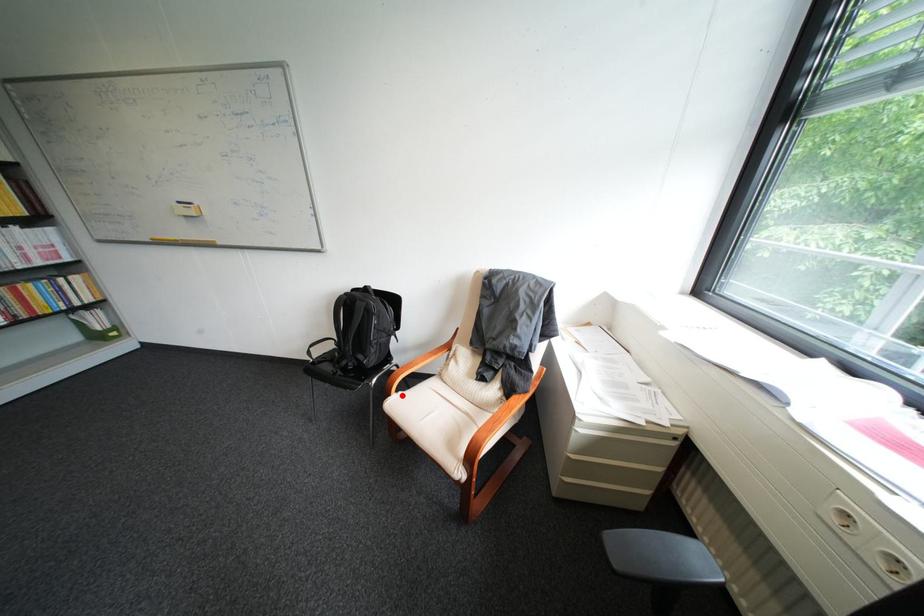
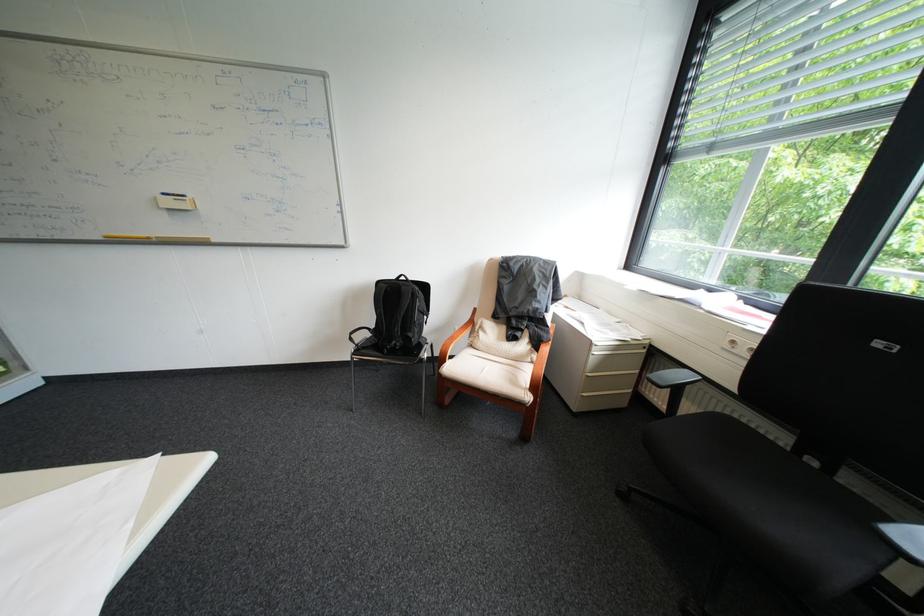
Find the pixel in the second image that matches the highlighted location in the first image.

(456, 363)